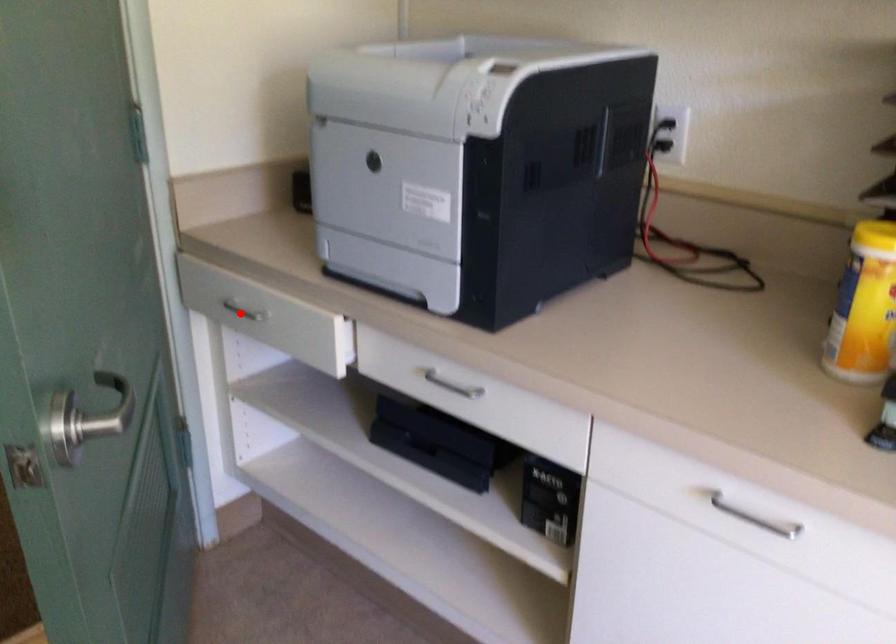
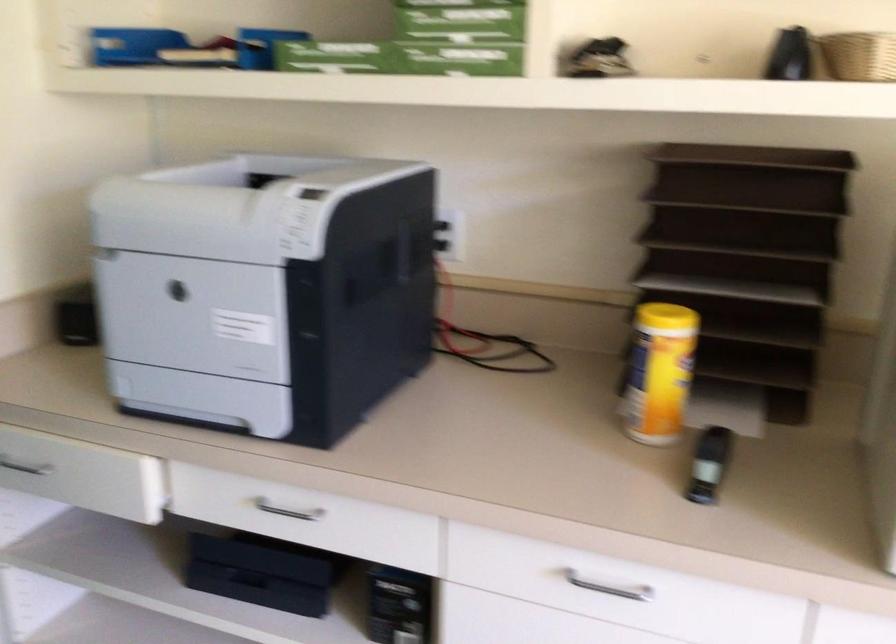
Question: I am providing you with two images of the same scene from different viewpoints. Image1 has a red point marked. In image2, the corresponding 3D location appears at what relative position? Reply with the corresponding letter.

Choices:
 (A) Closer
 (B) Farther

Answer: (A)